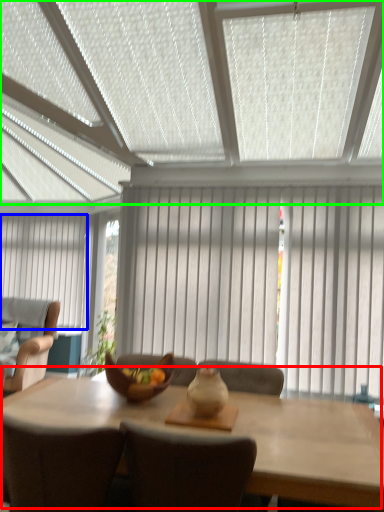
Question: Based on their relative distances, which object is farther from kitchen & dining room table (highlighted by a red box)? Choose from curtain (highlighted by a blue box) and window blind (highlighted by a green box).

Choices:
 (A) curtain
 (B) window blind

Answer: (A)